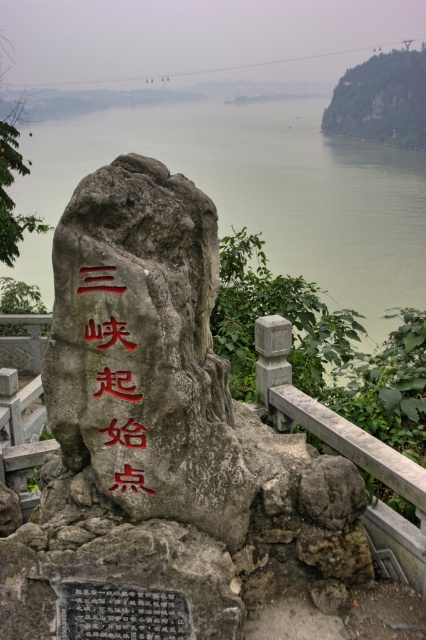
You are standing at the viewpoint and see the black stone plaque at center. There is a point marked at coordinates [120,612]. Where is this point located in relation to the plaque?

The point marked at coordinates [120,612] is located on the black stone plaque at center.

You are standing in front of the scenic view and want to touch both the black stone plaque at center and the red carved stone at center. Which one can you reach first without moving your feet?

The black stone plaque at center is further to the viewer than red carved stone at center, so you can reach the black stone plaque at center first without moving your feet.